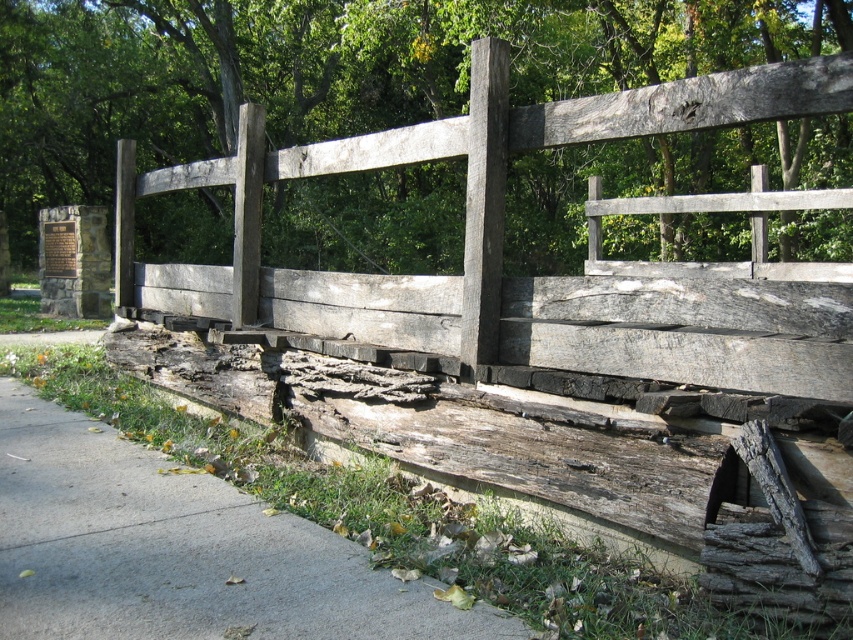
You are a delivery robot with a 2.5 meter wide package. You need to move from the gray concrete sidewalk at lower left to the weathered wood fence at center. Can you pass through the space between them?

The distance between the gray concrete sidewalk at lower left and the weathered wood fence at center is 4.06 meters, which is wider than the 2.5 meter wide package. Therefore, the delivery robot can pass through the space between them.

Consider the image. You are standing on the gray concrete sidewalk at lower left and want to walk towards the weathered wood fence at center. In which direction should you move?

You should move to the left because the gray concrete sidewalk at lower left is positioned on the right side of weathered wood fence at center, so moving left would take you towards the fence.

You are standing on the rustic wooden bridge and want to walk towards the end closest to you. Which point, point (128, 634) or point (180, 177), is closer to your current position?

Point (128, 634) is in front of point (180, 177), so it is closer to your current position on the bridge.